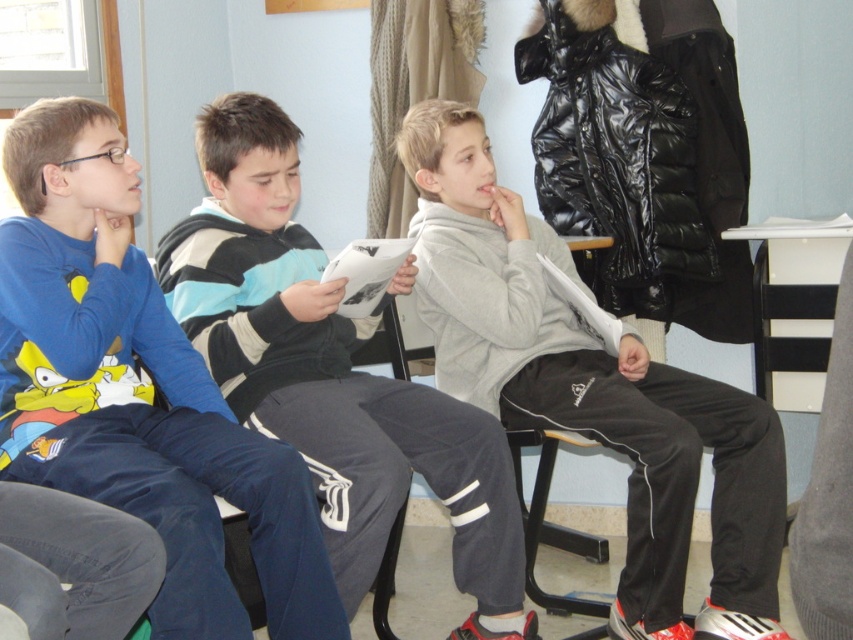
You are a tailor measuring the clothing items in the image. Which clothing item, the gray matte sweatshirt at center or the striped sweater at center, requires more fabric to make due to its larger width?

The gray matte sweatshirt at center requires more fabric because its width is larger than the striped sweater at center.

You are a photographer trying to capture a group photo of the blue cotton shirt at left and the striped sweater at center. Since you want them to be centered in the frame, which direction should you move the camera to align them properly?

The blue cotton shirt at left is positioned on the left side of striped sweater at center, so to center them in the frame, you should move the camera slightly to the left to bring the blue cotton shirt at left closer to the center while keeping the striped sweater at center in alignment.

You are standing in front of the three boys and want to place a small gift on the floor. You have two options for placement based on coordinates given in the scene. The first option is at point (209, 419) and the second is at point (206, 109). Which point is closer to you where you can place the gift easily?

Point (209, 419) is closer to the viewer than point (206, 109), so you should place the gift there for easier access.